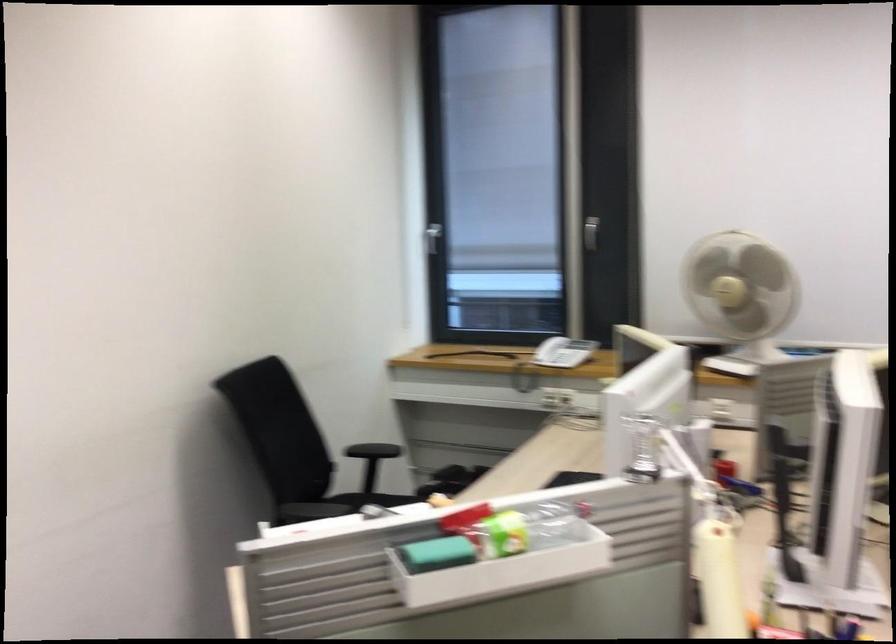
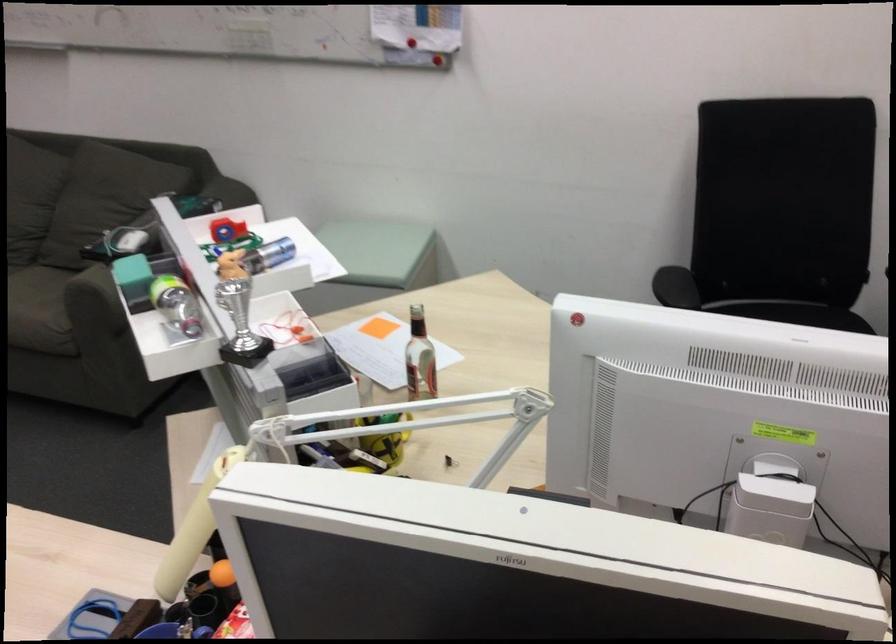
In the second image, find the point that corresponds to the point at 263,550 in the first image.

(221, 230)